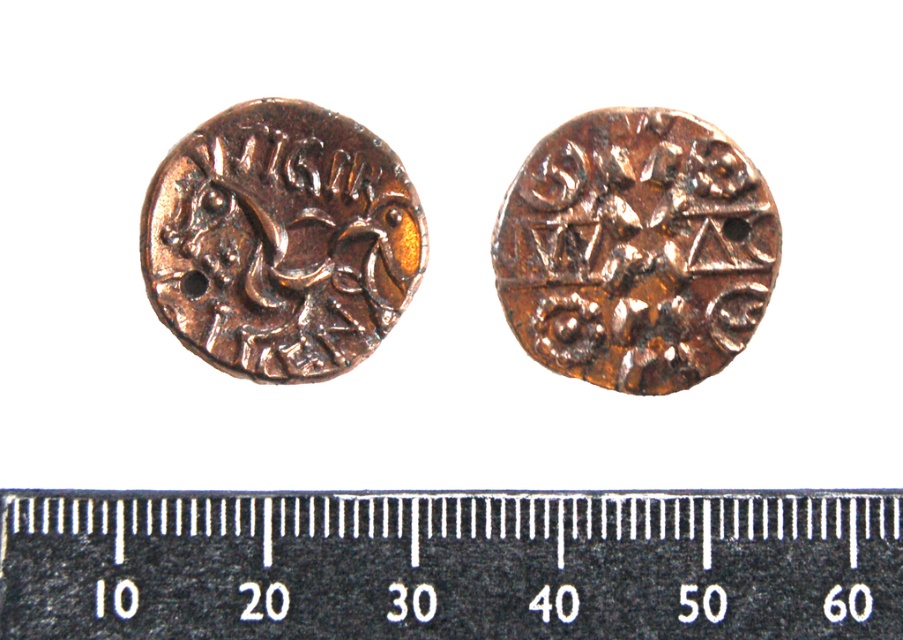
Does point (671, 364) come behind point (415, 276)?

That is False.

Who is more distant from viewer, (653, 346) or (342, 150)?

The point (653, 346) is more distant.

Is point (650, 364) positioned after point (291, 160)?

Yes, it is.

This screenshot has height=640, width=903. Find the location of `rusty copper coin at center`. rusty copper coin at center is located at coordinates (635, 250).

Is black metal ruler at bottom below rusty copper coin at center?

Yes.

Is point (303, 580) positioned before point (542, 157)?

Yes, point (303, 580) is closer to viewer.

Is point (533, 496) farther from viewer compared to point (566, 344)?

No, (533, 496) is closer to viewer.

Locate an element on the screen. black metal ruler at bottom is located at coordinates (450, 564).

Is black metal ruler at bottom to the right of bronze textured coin at upper left from the viewer's perspective?

Correct, you'll find black metal ruler at bottom to the right of bronze textured coin at upper left.

Is point (324, 570) closer to viewer compared to point (357, 348)?

Yes.

This screenshot has height=640, width=903. What are the coordinates of `black metal ruler at bottom` in the screenshot? It's located at pyautogui.click(x=450, y=564).